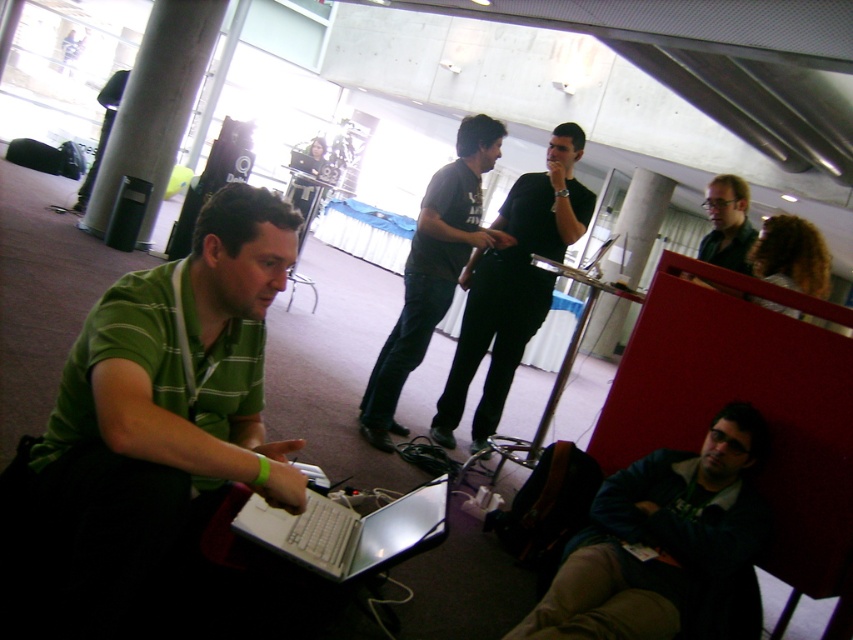
Question: Is silver metallic laptop at lower left to the left of matte black shirt at upper right from the viewer's perspective?

Choices:
 (A) no
 (B) yes

Answer: (B)

Question: Estimate the real-world distances between objects in this image. Which object is farther from the concrete pillar at center?

Choices:
 (A) dark gray shirt at center
 (B) white glossy pillar at center

Answer: (B)

Question: Estimate the real-world distances between objects in this image. Which object is closer to the dark gray t-shirt at center?

Choices:
 (A) curly hair at upper right
 (B) concrete pillar at center
 (C) green striped shirt at left
 (D) silver metallic laptop at lower left

Answer: (A)

Question: Can you confirm if dark gray shirt at center is wider than curly hair at upper right?

Choices:
 (A) yes
 (B) no

Answer: (A)

Question: Which of these objects is positioned closest to the metallic silver laptop at center?

Choices:
 (A) dark gray shirt at center
 (B) dark gray t-shirt at center

Answer: (A)

Question: Does dark blue jacket at lower right appear on the left side of concrete pillar at center?

Choices:
 (A) no
 (B) yes

Answer: (A)